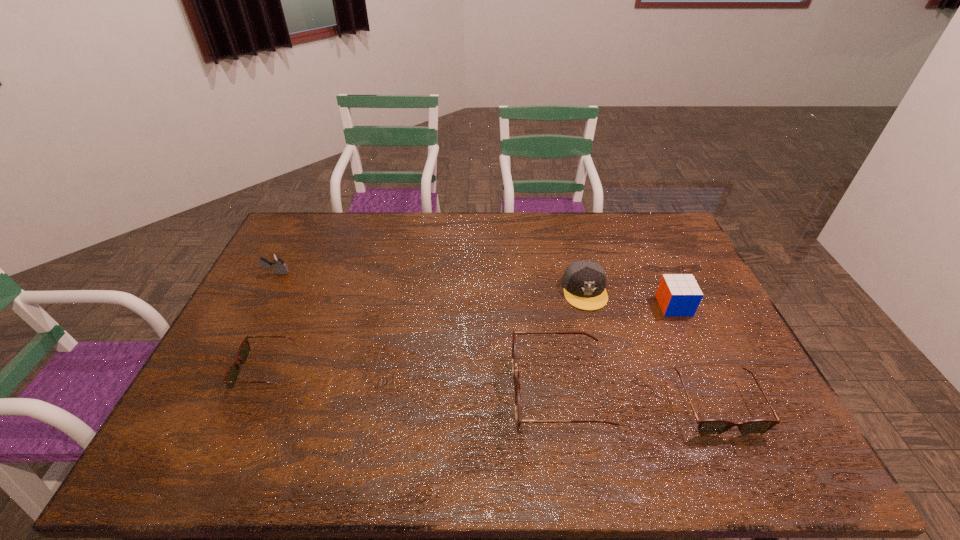
To make them evenly spaced by inserting another spectacles among them, please locate a vacant spot for this new spectacles. Please provide its 2D coordinates. Your answer should be formatted as a tuple, i.e. [(x, y)], where the tuple contains the x and y coordinates of a point satisfying the conditions above.

[(409, 381)]